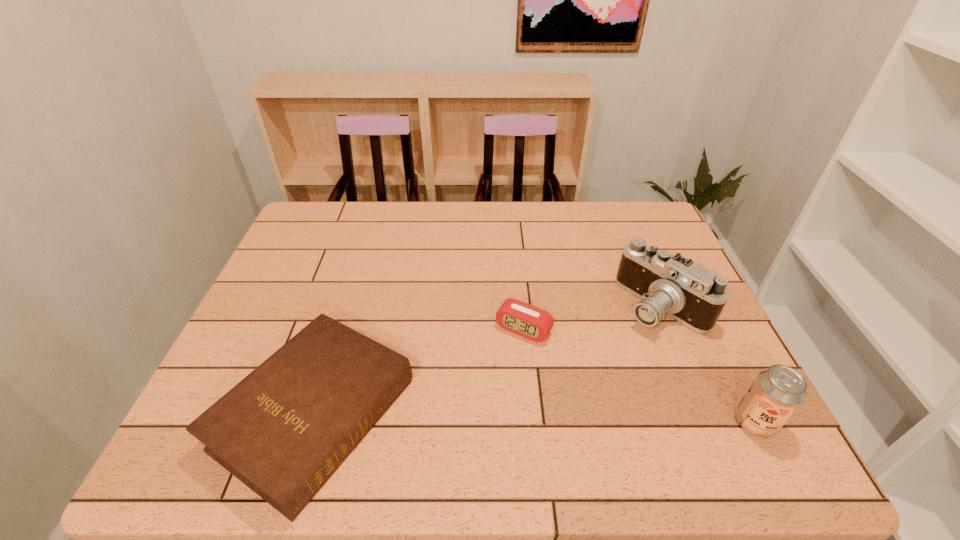
Locate an element on the screen. Image resolution: width=960 pixels, height=540 pixels. vacant space in between the camera and the shortest object is located at coordinates (592, 317).

Identify the location of free area in between the alarm clock and the beer can. (639, 375).

Find the location of a particular element. vacant point located between the second shortest object and the shortest object is located at coordinates (420, 372).

The image size is (960, 540). In order to click on vacant point located between the third tallest object and the beer can in this screenshot , I will do `click(535, 418)`.

Image resolution: width=960 pixels, height=540 pixels. In order to click on vacant area between the third tallest object and the camera in this screenshot , I will do `click(489, 360)`.

Find the location of a particular element. This screenshot has height=540, width=960. vacant space in between the second shortest object and the beer can is located at coordinates (535, 418).

Identify the location of vacant region between the beer can and the shortest object. The height and width of the screenshot is (540, 960). (639, 375).

Where is `the second closest object to the leftmost object`? This screenshot has height=540, width=960. the second closest object to the leftmost object is located at coordinates (688, 292).

Select which object appears as the closest to the beer can. Please provide its 2D coordinates. Your answer should be formatted as a tuple, i.e. [(x, y)], where the tuple contains the x and y coordinates of a point satisfying the conditions above.

[(688, 292)]

Locate an element on the screen. free point that satisfies the following two spatial constraints: 1. on the front side of the camera; 2. on the right side of the beer can is located at coordinates click(x=711, y=422).